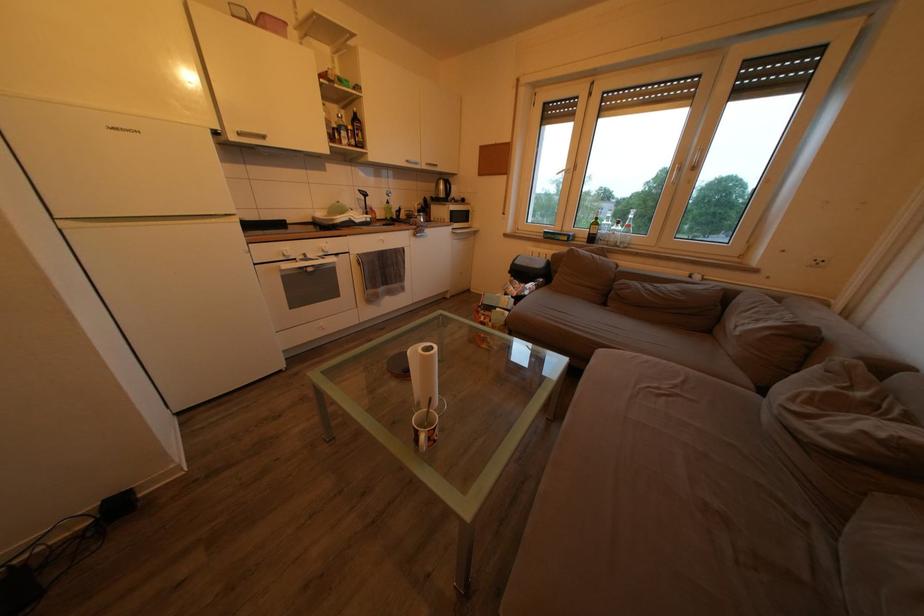
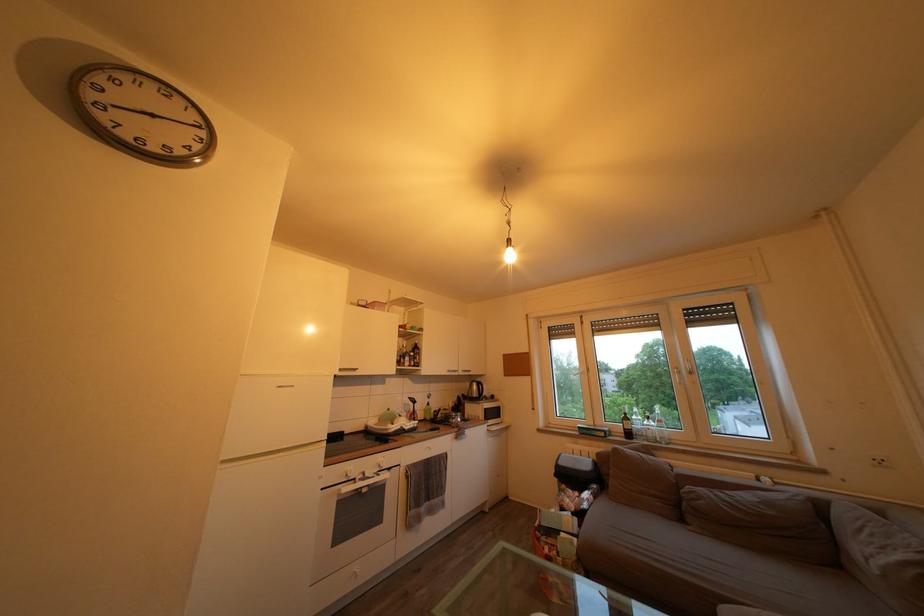
Locate, in the second image, the point that corresponds to [600,230] in the first image.

(630, 426)